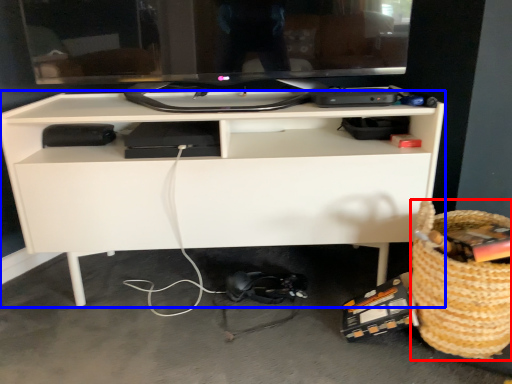
Question: Which point is closer to the camera, basket (highlighted by a red box) or desk (highlighted by a blue box)?

Choices:
 (A) basket
 (B) desk

Answer: (A)